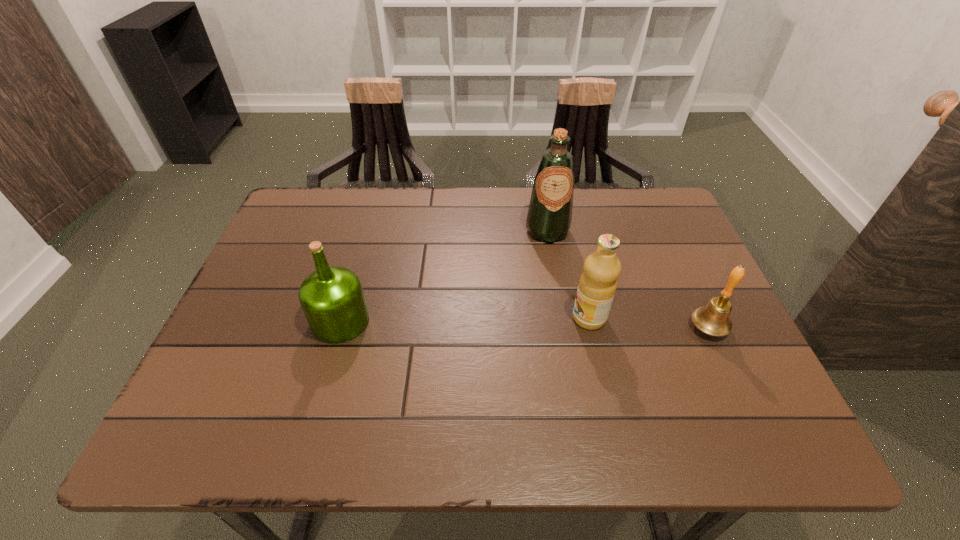
At what (x,y) coordinates should I click in order to perform the action: click on the farthest object. Please return your answer as a coordinate pair (x, y). This screenshot has height=540, width=960. Looking at the image, I should click on (549, 217).

Locate an element on the screen. The image size is (960, 540). the farthest olive oil is located at coordinates (549, 217).

Where is `the leftmost object`? The image size is (960, 540). the leftmost object is located at coordinates (332, 298).

Where is `the rightmost object`? The width and height of the screenshot is (960, 540). the rightmost object is located at coordinates (713, 319).

Locate an element on the screen. bell is located at coordinates (713, 319).

The width and height of the screenshot is (960, 540). Identify the location of vacant area situated 0.120m on the front-facing side of the farthest object. (556, 276).

The height and width of the screenshot is (540, 960). Identify the location of free space located 0.190m on the left of the leftmost object. (228, 321).

I want to click on vacant space located 0.210m on the left of the rightmost object, so click(x=596, y=328).

Where is `object situated at the far edge`? This screenshot has height=540, width=960. object situated at the far edge is located at coordinates (549, 217).

The image size is (960, 540). I want to click on object situated at the right edge, so pyautogui.click(x=713, y=319).